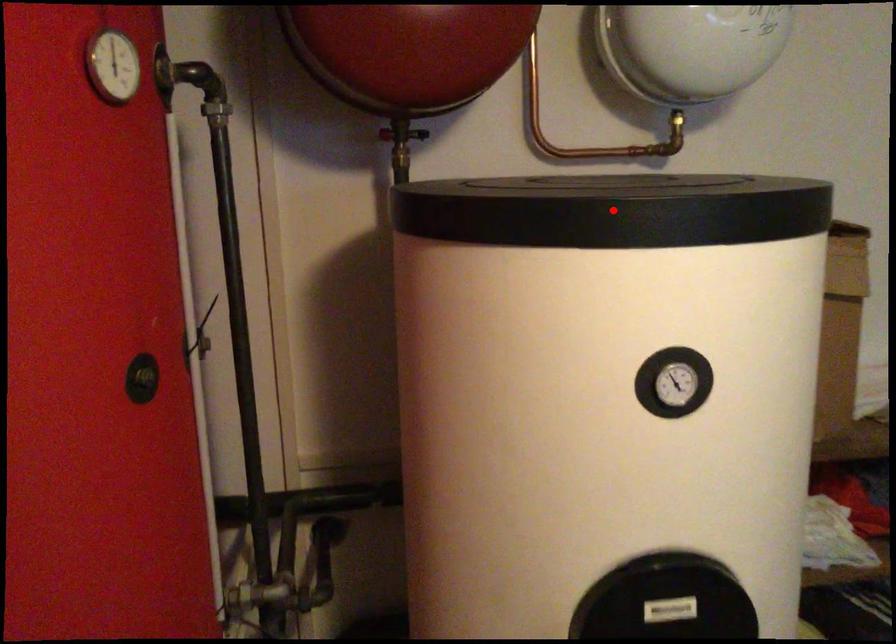
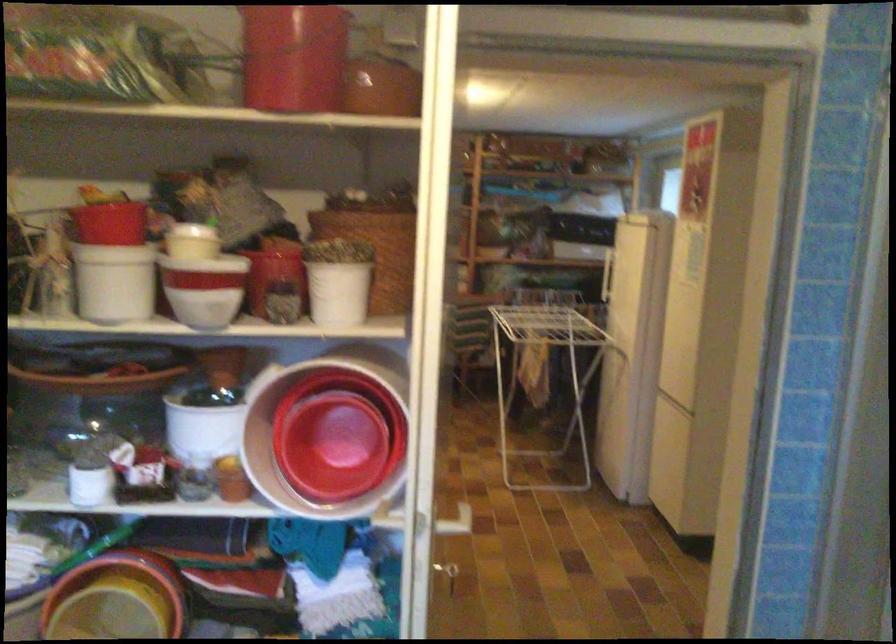
Question: I am providing you with two images of the same scene from different viewpoints. A red point is marked on the first image. At the location where the point appears in image 1, is it still visible in image 2?

Choices:
 (A) Yes
 (B) No

Answer: (B)